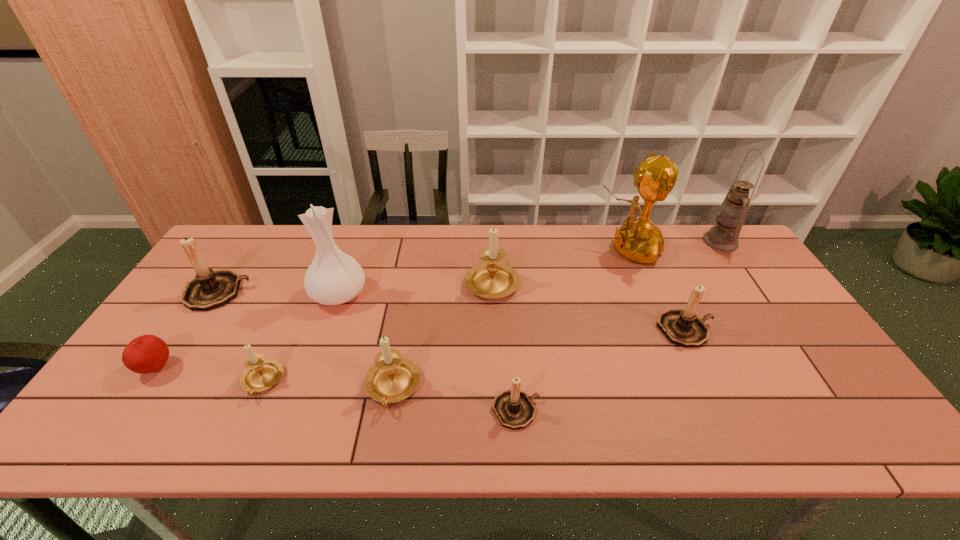
The height and width of the screenshot is (540, 960). I want to click on free space that is in between the apple and the eighth shortest object, so click(248, 331).

This screenshot has width=960, height=540. I want to click on free space between the smallest beige candle holder and the gold award, so click(444, 315).

Find the location of a particular element. Image resolution: width=960 pixels, height=540 pixels. empty location between the white vase and the leftmost brown candle holder is located at coordinates (278, 293).

Where is `unoccupied area between the rightmost candle holder and the second smallest beige candle holder`? The image size is (960, 540). unoccupied area between the rightmost candle holder and the second smallest beige candle holder is located at coordinates (539, 359).

You are a GUI agent. You are given a task and a screenshot of the screen. Output one action in this format:
    pyautogui.click(x=<x>, y=<y>)
    Task: Click on the unoccupied position between the second biggest beige candle holder and the fifth candle holder from right to left
    
    Given the screenshot: What is the action you would take?
    pyautogui.click(x=327, y=384)

Identify the location of the ninth closest object to the rightmost candle holder. This screenshot has width=960, height=540. (145, 354).

Identify which object is located as the sixth nearest to the award. Please provide its 2D coordinates. Your answer should be formatted as a tuple, i.e. [(x, y)], where the tuple contains the x and y coordinates of a point satisfying the conditions above.

[(334, 277)]

Locate which candle holder ranks third in proximity to the fifth candle holder from right to left. Please provide its 2D coordinates. Your answer should be formatted as a tuple, i.e. [(x, y)], where the tuple contains the x and y coordinates of a point satisfying the conditions above.

[(492, 279)]

The height and width of the screenshot is (540, 960). I want to click on the second closest candle holder relative to the smallest brown candle holder, so click(x=492, y=279).

Select which beige candle holder appears as the third closest to the second smallest brown candle holder. Please provide its 2D coordinates. Your answer should be formatted as a tuple, i.e. [(x, y)], where the tuple contains the x and y coordinates of a point satisfying the conditions above.

[(260, 374)]